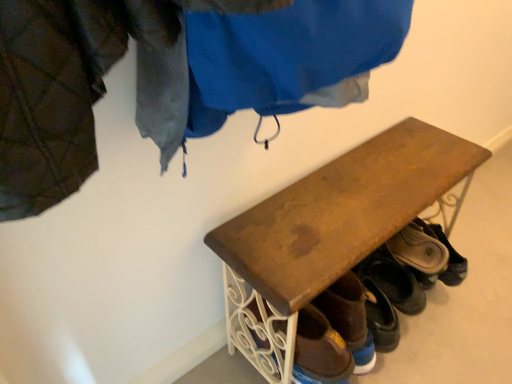
Find the location of a particular element. vacant region above wooden bench at center (from a real-world perspective) is located at coordinates (376, 183).